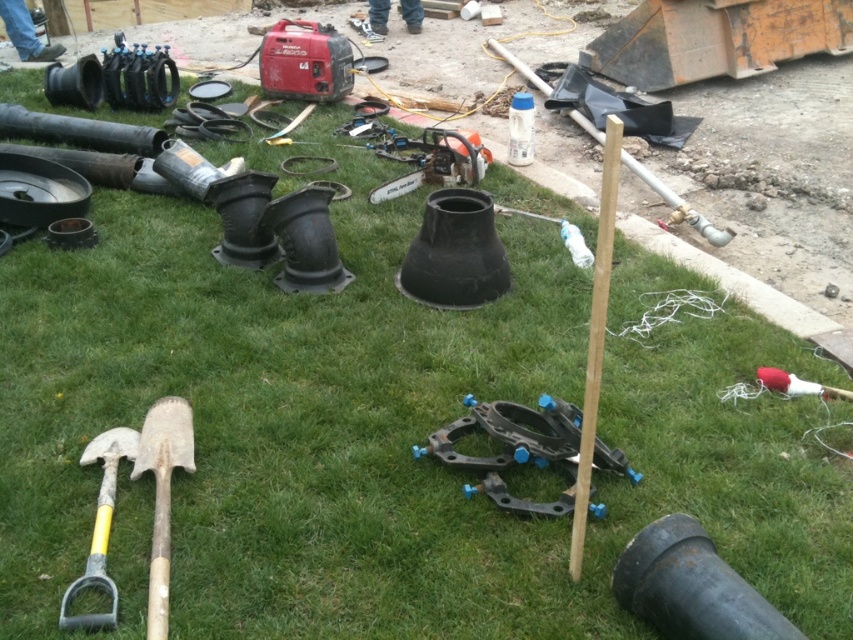
Find the location of a particular element. black plastic clamps at center is located at coordinates (514, 448).

Does point (552, 509) come in front of point (100, 552)?

No, it is behind (100, 552).

Where is `black plastic clamps at center`? black plastic clamps at center is located at coordinates (514, 448).

Can you confirm if wooden handle shovel at lower left is thinner than yellow handle shovel at lower left?

Correct, wooden handle shovel at lower left's width is less than yellow handle shovel at lower left's.

Which is in front, point (178, 461) or point (115, 605)?

Point (115, 605) is in front.

Locate an element on the screen. The image size is (853, 640). wooden handle shovel at lower left is located at coordinates (161, 493).

Is black plastic clamps at center wider than wooden handle shovel at lower left?

Indeed, black plastic clamps at center has a greater width compared to wooden handle shovel at lower left.

The image size is (853, 640). In order to click on black plastic clamps at center in this screenshot , I will do `click(514, 448)`.

Locate an element on the screen. The height and width of the screenshot is (640, 853). black plastic clamps at center is located at coordinates coord(514,448).